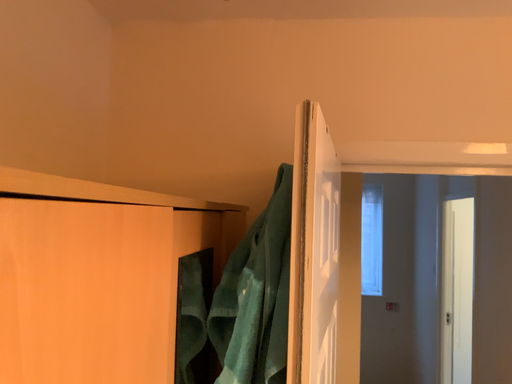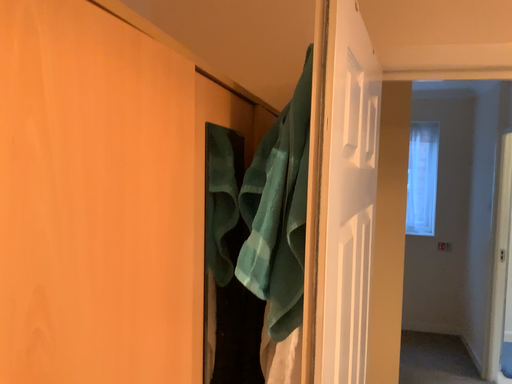
Question: Which way did the camera rotate in the video?

Choices:
 (A) rotated left
 (B) rotated right

Answer: (A)